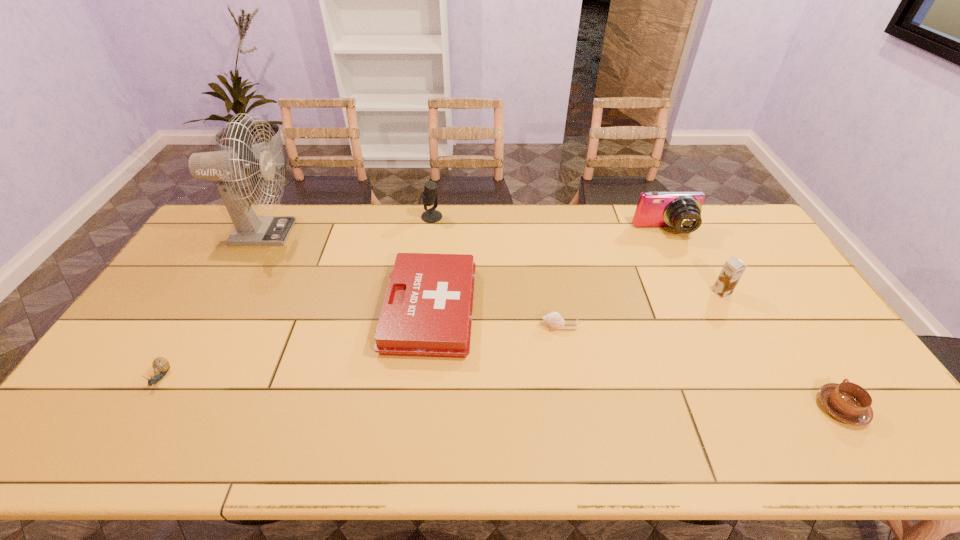
The width and height of the screenshot is (960, 540). What are the coordinates of `free space located on the front-facing side of the nearer escargot` in the screenshot? It's located at (125, 437).

Identify the location of fan that is positioned at the far edge. (230, 167).

The image size is (960, 540). What are the coordinates of `microphone that is at the far edge` in the screenshot? It's located at (429, 197).

This screenshot has width=960, height=540. In order to click on camera that is at the far edge in this screenshot , I will do `click(682, 210)`.

The image size is (960, 540). What are the coordinates of `object that is at the near edge` in the screenshot? It's located at (848, 402).

In order to click on fan that is at the left edge in this screenshot , I will do `click(230, 167)`.

At what (x,y) coordinates should I click in order to perform the action: click on escargot present at the left edge. Please return your answer as a coordinate pair (x, y). This screenshot has height=540, width=960. Looking at the image, I should click on (160, 365).

Locate an element on the screen. The image size is (960, 540). object that is at the right edge is located at coordinates (848, 402).

Locate an element on the screen. Image resolution: width=960 pixels, height=540 pixels. object present at the far left corner is located at coordinates (230, 167).

The image size is (960, 540). Identify the location of object that is at the near right corner. (848, 402).